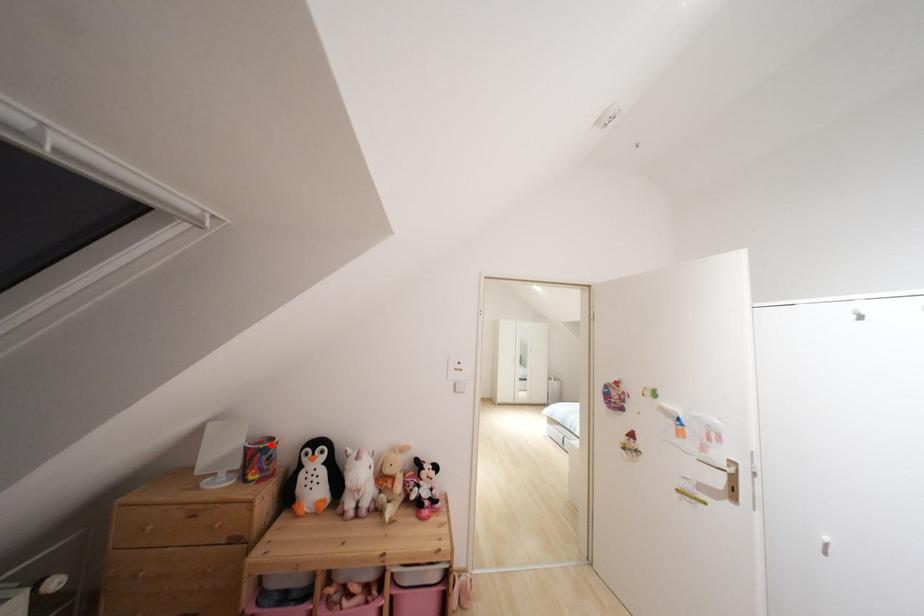
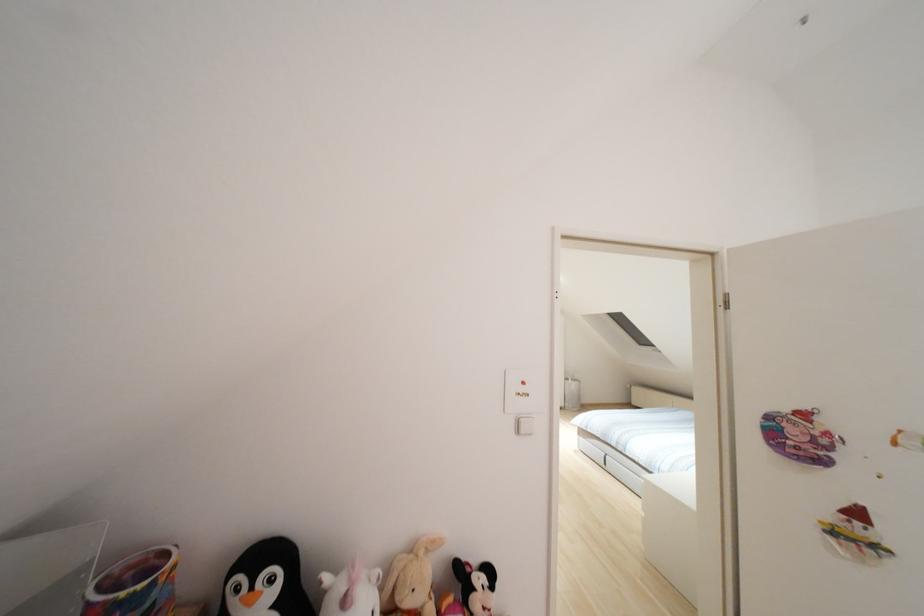
Find the pixel in the second image that matches the highlighted location in the first image.

(152, 584)